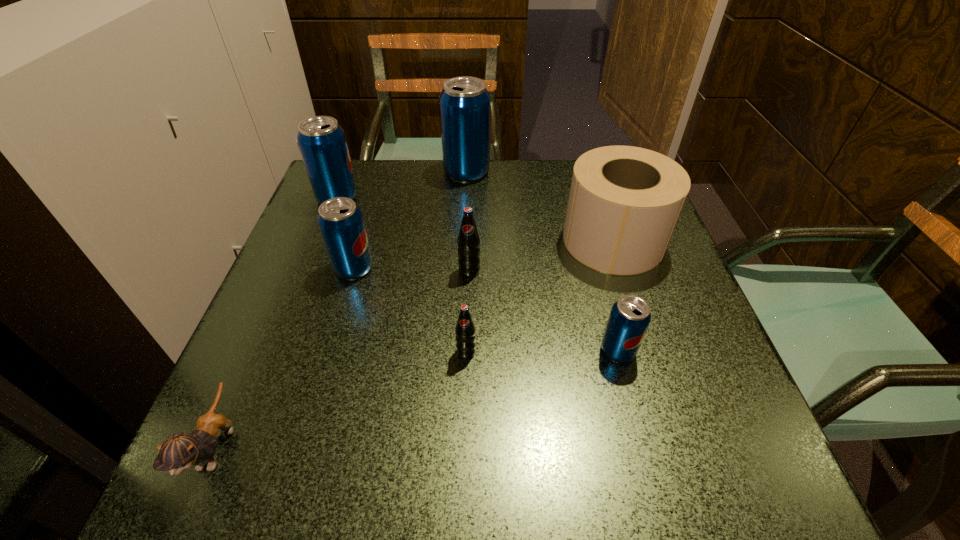
This screenshot has height=540, width=960. I want to click on object located at the near edge, so click(x=179, y=452).

Image resolution: width=960 pixels, height=540 pixels. What are the coordinates of `kitten located at the left edge` in the screenshot? It's located at (179, 452).

Locate an element on the screen. toilet tissue present at the right edge is located at coordinates (624, 203).

The image size is (960, 540). Find the location of `pop soda located at the right edge`. pop soda located at the right edge is located at coordinates click(x=630, y=316).

This screenshot has width=960, height=540. In order to click on object that is at the far left corner in this screenshot , I will do `click(322, 142)`.

Locate an element on the screen. object that is at the near left corner is located at coordinates (179, 452).

This screenshot has height=540, width=960. What are the coordinates of `object situated at the far right corner` in the screenshot? It's located at (624, 203).

The height and width of the screenshot is (540, 960). In order to click on blank area at the far edge in this screenshot , I will do `click(530, 185)`.

Identify the location of free space at the near edge of the desktop. This screenshot has width=960, height=540. (502, 440).

This screenshot has width=960, height=540. In the image, there is a desktop. Identify the location of vacant area at the left edge. (293, 397).